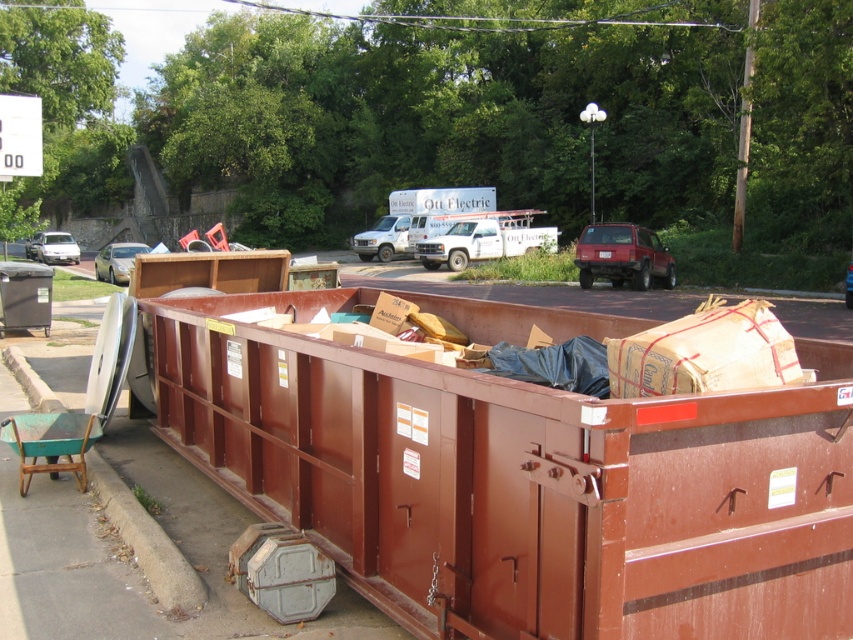
You are a delivery driver who needs to park your vehicle between the red matte suv at center and the shiny silver sedan at left. Given that your truck is 1.8 meters tall, will there be enough vertical clearance to park between them?

The red matte suv at center is shorter than the shiny silver sedan at left. Since the sedan is taller, the vertical clearance between them would depend on the lowest point. However, without specific height data for the space between them, it is impossible to determine if 1.8 meters will fit. Please check the actual space before parking.